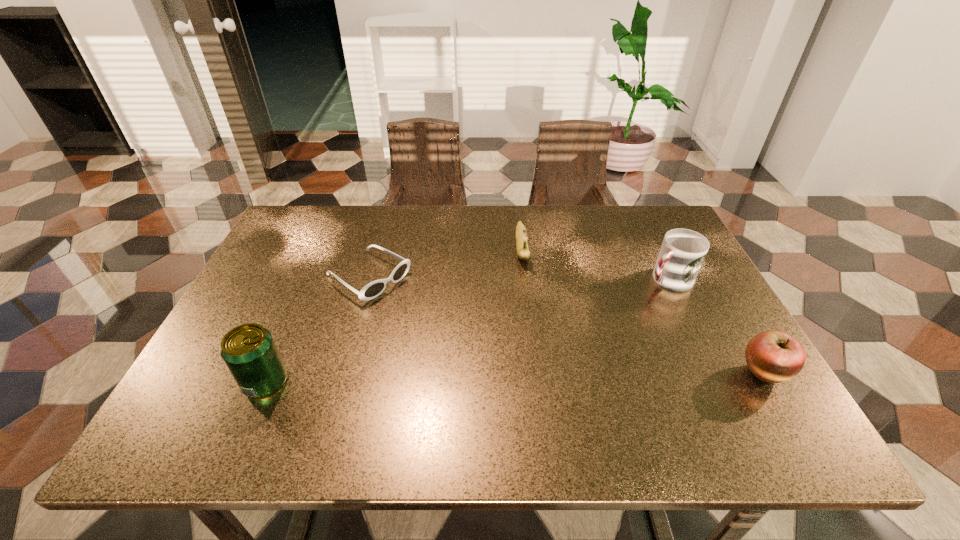
Locate an element on the screen. apple located in the right edge section of the desktop is located at coordinates (773, 356).

The width and height of the screenshot is (960, 540). I want to click on cup present at the right edge, so click(682, 253).

Where is `object that is at the near left corner`? The height and width of the screenshot is (540, 960). object that is at the near left corner is located at coordinates (248, 350).

What are the coordinates of `object situated at the near right corner` in the screenshot? It's located at (773, 356).

The image size is (960, 540). What are the coordinates of `vacant space at the far edge of the desktop` in the screenshot? It's located at (568, 213).

You are a GUI agent. You are given a task and a screenshot of the screen. Output one action in this format:
    pyautogui.click(x=<x>, y=<y>)
    Task: Click on the free space at the near edge of the desktop
    The image size is (960, 540).
    Given the screenshot: What is the action you would take?
    pyautogui.click(x=645, y=392)

This screenshot has height=540, width=960. In the image, there is a desktop. What are the coordinates of `free space at the left edge` in the screenshot? It's located at (274, 299).

Locate an element on the screen. Image resolution: width=960 pixels, height=540 pixels. free space at the right edge is located at coordinates (703, 336).

Locate an element on the screen. Image resolution: width=960 pixels, height=540 pixels. vacant space at the far left corner is located at coordinates (291, 232).

What are the coordinates of `free space at the near left corner of the desktop` in the screenshot? It's located at (202, 383).